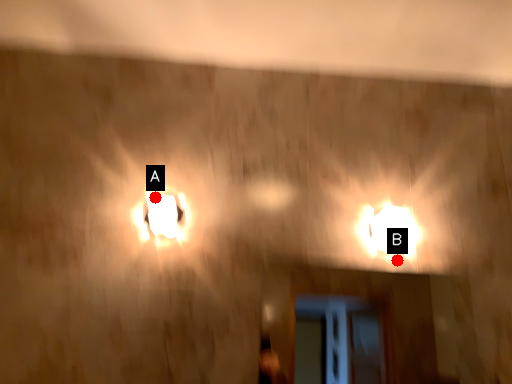
Question: Two points are circled on the image, labeled by A and B beside each circle. Among these points, which one is farthest from the camera?

Choices:
 (A) A is further
 (B) B is further

Answer: (B)